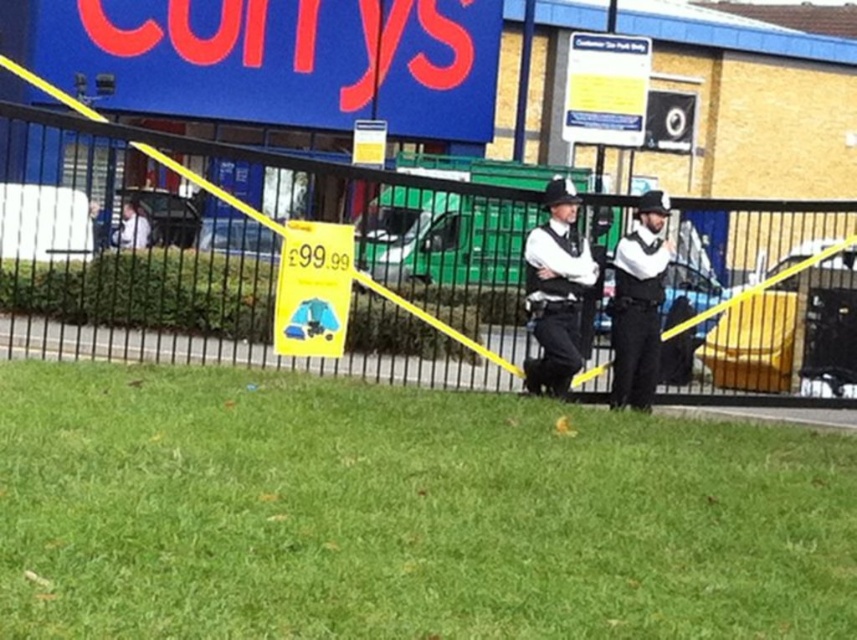
You are a delivery person trying to see if you can safely pass through the area between the black metal fence at center and the white uniform at center. Considering their heights, can you walk through without ducking?

The black metal fence at center is taller than the white uniform at center. Since the fence is taller, you would need to duck only if the fence height is below your head height. However, since the uniform is shorter than the fence, the main concern would be the fence height. Without specific measurements, it is hard to determine if ducking is necessary. But since the fence is taller than the uniform, focus on the fence height when deciding whether to duck.

You are a delivery person approaching the store and need to leave a package at the black metal fence at center. The security guard in the white uniform at center is blocking your path. Can you place the package at the fence without moving the security guard?

The black metal fence at center is closer to the viewer than the white uniform at center, so you can place the package at the black metal fence at center without needing to move the security guard in the white uniform at center since they are further away.

You are a delivery person approaching the store and need to locate two specific points marked on the fence. The first point is at coordinates point (577, 305) and the second is at point (634, 333). Which point is closer to you as you stand in front of the fence?

Point (577, 305) is further to the camera than point (634, 333), so the point closer to you would be point (634, 333).